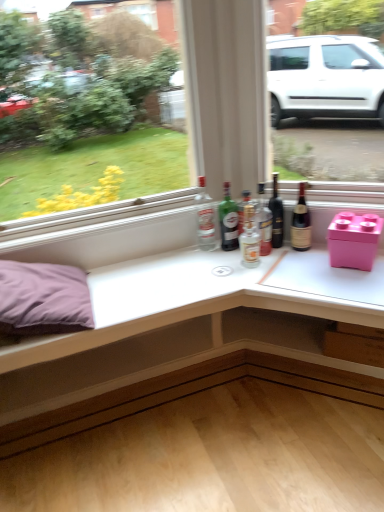
Describe the element at coordinates (228, 221) in the screenshot. I see `green glass bottle at center, which ranks as the 4th bottle in right-to-left order` at that location.

The width and height of the screenshot is (384, 512). What are the coordinates of `translucent glass bottle at center, acting as the 2th bottle starting from the right` in the screenshot? It's located at (263, 222).

Measure the distance between translucent glass bottle at center, placed as the third bottle when sorted from right to left, and camera.

A distance of 1.85 meters exists between translucent glass bottle at center, placed as the third bottle when sorted from right to left, and camera.

This screenshot has height=512, width=384. What do you see at coordinates (276, 215) in the screenshot?
I see `dark glass bottle at center` at bounding box center [276, 215].

I want to click on brown glass bottle at right, the 1th bottle viewed from the right, so click(301, 223).

This screenshot has width=384, height=512. Identify the location of clear glass bottle at center, which ranks as the 5th bottle in right-to-left order. (205, 218).

Where is `green glass bottle at center, which ranks as the 4th bottle in right-to-left order`? This screenshot has width=384, height=512. green glass bottle at center, which ranks as the 4th bottle in right-to-left order is located at coordinates (228, 221).

Is pink plastic storage box at right completely or partially inside white glossy table at upper center?

Definitely not — pink plastic storage box at right is not inside white glossy table at upper center.

Considering the relative positions of white glossy table at upper center and pink plastic storage box at right in the image provided, is white glossy table at upper center to the left or to the right of pink plastic storage box at right?

white glossy table at upper center is to the left of pink plastic storage box at right.

Based on the photo, how far apart are white glossy table at upper center and pink plastic storage box at right?

27.57 inches.

In the scene shown: Between white glossy table at upper center and pink plastic storage box at right, which one has more height?

white glossy table at upper center is taller.

From the image's perspective, which one is positioned higher, clear glass bottle at center, which ranks as the 5th bottle in right-to-left order, or translucent glass bottle at center, acting as the 2th bottle starting from the right?

From the image's view, clear glass bottle at center, which ranks as the 5th bottle in right-to-left order, is above.

Is clear glass bottle at center, which is the first bottle in left-to-right order, inside or outside of translucent glass bottle at center, the fourth bottle from the left?

clear glass bottle at center, which is the first bottle in left-to-right order, exists outside the volume of translucent glass bottle at center, the fourth bottle from the left.

Considering the relative sizes of clear glass bottle at center, which ranks as the 5th bottle in right-to-left order, and translucent glass bottle at center, acting as the 2th bottle starting from the right, in the image provided, is clear glass bottle at center, which ranks as the 5th bottle in right-to-left order, thinner than translucent glass bottle at center, acting as the 2th bottle starting from the right,?

Incorrect, the width of clear glass bottle at center, which ranks as the 5th bottle in right-to-left order, is not less than that of translucent glass bottle at center, acting as the 2th bottle starting from the right.

Can you tell me how much clear glass bottle at center, which ranks as the 5th bottle in right-to-left order, and translucent glass bottle at center, the fourth bottle from the left, differ in facing direction?

clear glass bottle at center, which ranks as the 5th bottle in right-to-left order, and translucent glass bottle at center, the fourth bottle from the left, are facing 22.7 degrees away from each other.

How different are the orientations of clear glass bottle at center, which ranks as the 5th bottle in right-to-left order, and pink plastic storage box at right in degrees?

There is a 34.5-degree angle between the facing directions of clear glass bottle at center, which ranks as the 5th bottle in right-to-left order, and pink plastic storage box at right.

Does clear glass bottle at center, which is the first bottle in left-to-right order, turn towards pink plastic storage box at right?

No, clear glass bottle at center, which is the first bottle in left-to-right order, does not turn towards pink plastic storage box at right.

Is clear glass bottle at center, which is the first bottle in left-to-right order, inside the boundaries of pink plastic storage box at right, or outside?

clear glass bottle at center, which is the first bottle in left-to-right order, is located beyond the bounds of pink plastic storage box at right.

From the image's perspective, which one is positioned lower, clear glass bottle at center, which ranks as the 5th bottle in right-to-left order, or pink plastic storage box at right?

pink plastic storage box at right.

Where is `bottle located behind the clear glass bottle at center, which is the first bottle in left-to-right order`? This screenshot has height=512, width=384. bottle located behind the clear glass bottle at center, which is the first bottle in left-to-right order is located at coordinates (243, 208).

Is clear glass bottle at center, which ranks as the 5th bottle in right-to-left order, surrounding translucent glass bottle at center, the third bottle viewed from the left?

No, translucent glass bottle at center, the third bottle viewed from the left, is located outside of clear glass bottle at center, which ranks as the 5th bottle in right-to-left order.

From a real-world perspective, who is located lower, clear glass bottle at center, which ranks as the 5th bottle in right-to-left order, or translucent glass bottle at center, placed as the third bottle when sorted from right to left?

From a 3D spatial view, translucent glass bottle at center, placed as the third bottle when sorted from right to left, is below.

Based on the photo, is clear glass bottle at center, which is the first bottle in left-to-right order, touching translucent glass bottle at center, the third bottle viewed from the left?

clear glass bottle at center, which is the first bottle in left-to-right order, and translucent glass bottle at center, the third bottle viewed from the left, are clearly separated.

Considering the points (258, 222) and (211, 223), which point is in front, point (258, 222) or point (211, 223)?

The point (258, 222) is closer to the camera.

How many degrees apart are the facing directions of translucent glass bottle at center, acting as the 2th bottle starting from the right, and clear glass bottle at center, which is the first bottle in left-to-right order?

22.7 degrees separate the facing orientations of translucent glass bottle at center, acting as the 2th bottle starting from the right, and clear glass bottle at center, which is the first bottle in left-to-right order.

From the image's perspective, which bottle is the 4th one below the clear glass bottle at center, which is the first bottle in left-to-right order? Please provide its 2D coordinates.

[(263, 222)]

Does translucent glass bottle at center, acting as the 2th bottle starting from the right, come behind clear glass bottle at center, which ranks as the 5th bottle in right-to-left order?

That is False.

Considering the sizes of objects dark glass bottle at center and translucent glass bottle at center, placed as the third bottle when sorted from right to left, in the image provided, who is smaller, dark glass bottle at center or translucent glass bottle at center, placed as the third bottle when sorted from right to left,?

With smaller size is translucent glass bottle at center, placed as the third bottle when sorted from right to left.

Can you tell me how much dark glass bottle at center and translucent glass bottle at center, the third bottle viewed from the left, differ in facing direction?

dark glass bottle at center and translucent glass bottle at center, the third bottle viewed from the left, are facing 27 degrees away from each other.

From the image's perspective, is dark glass bottle at center over translucent glass bottle at center, placed as the third bottle when sorted from right to left?

Yes, from the image's perspective, dark glass bottle at center is on top of translucent glass bottle at center, placed as the third bottle when sorted from right to left.

Consider the image. Is dark glass bottle at center completely or partially outside of translucent glass bottle at center, the third bottle viewed from the left?

Yes, dark glass bottle at center is outside of translucent glass bottle at center, the third bottle viewed from the left.

Is the surface of white glossy table at upper center in direct contact with translucent glass bottle at center, acting as the 2th bottle starting from the right?

No, white glossy table at upper center is not with translucent glass bottle at center, acting as the 2th bottle starting from the right.

Between point (247, 362) and point (265, 208), which one is positioned behind?

Positioned behind is point (265, 208).

Would you say white glossy table at upper center contains translucent glass bottle at center, acting as the 2th bottle starting from the right?

No, white glossy table at upper center does not contain translucent glass bottle at center, acting as the 2th bottle starting from the right.

Find the location of a particular element. The image size is (384, 512). the 2nd bottle counting from the right of the white glossy table at upper center is located at coordinates (263, 222).

Locate an element on the screen. The image size is (384, 512). table below the pink plastic storage box at right (from the image's perspective) is located at coordinates (187, 340).

Starting from the clear glass bottle at center, which ranks as the 5th bottle in right-to-left order, which bottle is the 3rd one to the right? Please provide its 2D coordinates.

[(263, 222)]

Estimate the real-world distances between objects in this image. Which object is further from pink plastic storage box at right, translucent glass bottle at center, acting as the 2th bottle starting from the right, or white glossy table at upper center?

white glossy table at upper center lies further to pink plastic storage box at right than the other object.

Based on their spatial positions, is translucent glass bottle at center, placed as the third bottle when sorted from right to left, or brown glass bottle at right, the 1th bottle viewed from the right, further from green glass bottle at center, which is counted as the 2th bottle, starting from the left?

brown glass bottle at right, the 1th bottle viewed from the right, lies further to green glass bottle at center, which is counted as the 2th bottle, starting from the left, than the other object.

From the image, which object appears to be nearer to clear glass bottle at center, which is the first bottle in left-to-right order, translucent glass bottle at center, the fourth bottle from the left, or dark glass bottle at center?

translucent glass bottle at center, the fourth bottle from the left.

Considering their positions, is brown glass bottle at right, arranged as the fifth bottle when viewed from the left, positioned closer to green glass bottle at center, which ranks as the 4th bottle in right-to-left order, than dark glass bottle at center?

dark glass bottle at center.

Considering their positions, is white glossy table at upper center positioned further to dark glass bottle at center than translucent glass bottle at center, the fourth bottle from the left?

white glossy table at upper center is further to dark glass bottle at center.

Based on their spatial positions, is white glossy table at upper center or green glass bottle at center, which ranks as the 4th bottle in right-to-left order, closer to translucent glass bottle at center, placed as the third bottle when sorted from right to left?

green glass bottle at center, which ranks as the 4th bottle in right-to-left order.

Based on their spatial positions, is pink plastic storage box at right or translucent glass bottle at center, placed as the third bottle when sorted from right to left, further from white glossy table at upper center?

Among the two, translucent glass bottle at center, placed as the third bottle when sorted from right to left, is located further to white glossy table at upper center.

Which object lies further to the anchor point green glass bottle at center, which is counted as the 2th bottle, starting from the left, translucent glass bottle at center, acting as the 2th bottle starting from the right, or white glossy table at upper center?

The object further to green glass bottle at center, which is counted as the 2th bottle, starting from the left, is white glossy table at upper center.

The image size is (384, 512). In order to click on beer bottle located between clear glass bottle at center, which is the first bottle in left-to-right order, and brown glass bottle at right, the 1th bottle viewed from the right, in the left-right direction in this screenshot , I will do `click(276, 215)`.

Find the location of a particular element. This screenshot has height=512, width=384. storage box between white glossy table at upper center and dark glass bottle at center along the z-axis is located at coordinates (354, 240).

Where is `beer bottle between white glossy table at upper center and green glass bottle at center, which ranks as the 4th bottle in right-to-left order, along the z-axis`? beer bottle between white glossy table at upper center and green glass bottle at center, which ranks as the 4th bottle in right-to-left order, along the z-axis is located at coordinates (276, 215).

Locate an element on the screen. The width and height of the screenshot is (384, 512). bottle between green glass bottle at center, which ranks as the 4th bottle in right-to-left order, and translucent glass bottle at center, acting as the 2th bottle starting from the right, from left to right is located at coordinates (243, 208).